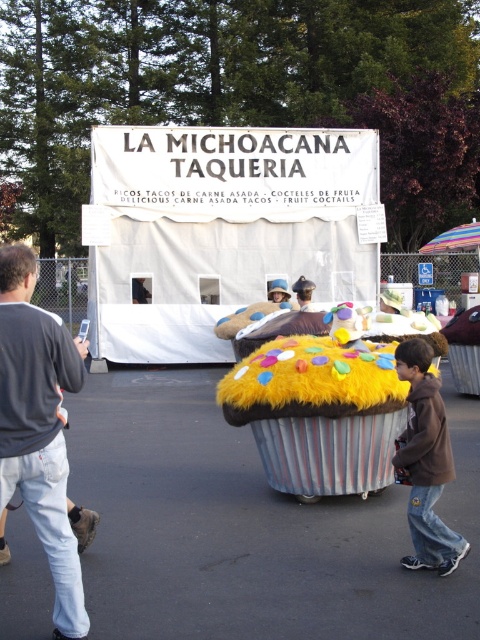
Question: Can you confirm if gray sweater at left is positioned to the left of brown fuzzy jacket at lower right?

Choices:
 (A) yes
 (B) no

Answer: (A)

Question: Where is gray sweater at left located in relation to brown fuzzy jacket at lower right in the image?

Choices:
 (A) below
 (B) above

Answer: (B)

Question: Is the position of gray sweater at left less distant than that of brown fuzzy jacket at lower right?

Choices:
 (A) yes
 (B) no

Answer: (A)